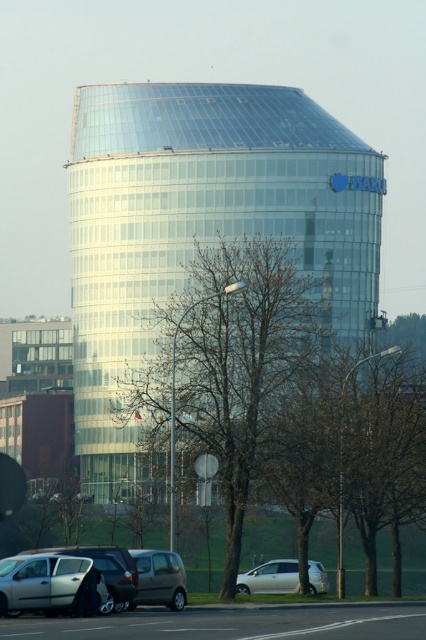
Can you confirm if silver metallic sedan at lower left is thinner than white matte van at lower center?

Yes.

Image resolution: width=426 pixels, height=640 pixels. What do you see at coordinates (40, 580) in the screenshot?
I see `silver metallic sedan at lower left` at bounding box center [40, 580].

Find the location of a particular element. silver metallic sedan at lower left is located at coordinates (40, 580).

Between silver metallic sedan at lower left and metallic gray van at lower left, which one is positioned lower?

metallic gray van at lower left

Who is shorter, silver metallic sedan at lower left or metallic gray van at lower left?

silver metallic sedan at lower left

Is point (52, 563) positioned before point (181, 561)?

Yes, point (52, 563) is in front of point (181, 561).

Where is `silver metallic sedan at lower left`? silver metallic sedan at lower left is located at coordinates (40, 580).

In the scene shown: Is bare branches at center to the right of silver metallic sedan at lower left from the viewer's perspective?

Indeed, bare branches at center is positioned on the right side of silver metallic sedan at lower left.

How far apart are bare branches at center and silver metallic sedan at lower left?

A distance of 20.13 meters exists between bare branches at center and silver metallic sedan at lower left.

What do you see at coordinates (227, 364) in the screenshot? I see `bare branches at center` at bounding box center [227, 364].

Find the location of `bare branches at center`. bare branches at center is located at coordinates (227, 364).